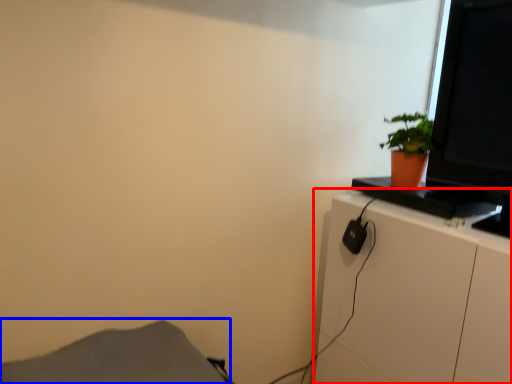
Question: Which point is closer to the camera, cabinetry (highlighted by a red box) or plain (highlighted by a blue box)?

Choices:
 (A) cabinetry
 (B) plain

Answer: (B)